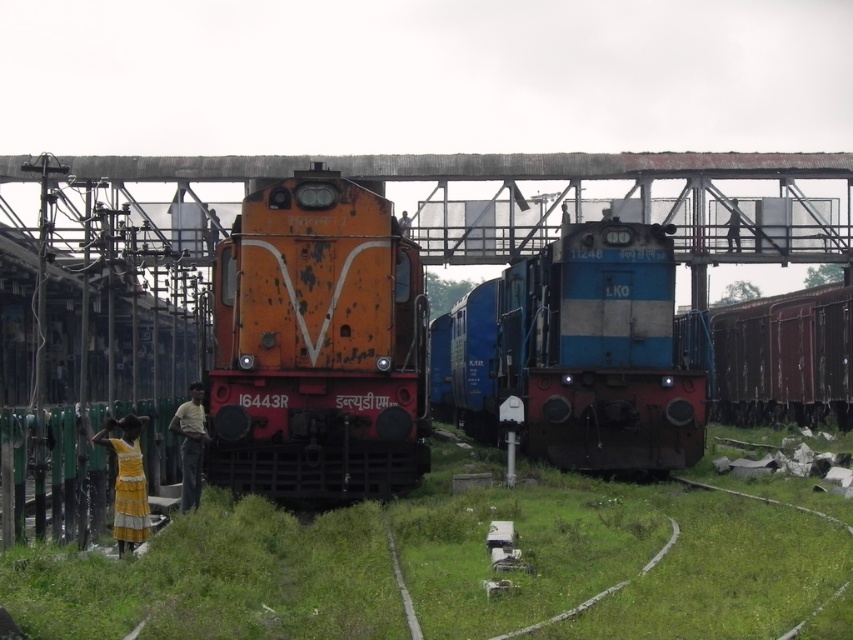
Between point (753, 244) and point (138, 493), which one is positioned in front?

Positioned in front is point (138, 493).

Can you confirm if metallic bridge at upper center is wider than yellow cotton dress at lower left?

Indeed, metallic bridge at upper center has a greater width compared to yellow cotton dress at lower left.

Find the location of a particular element. The width and height of the screenshot is (853, 640). metallic bridge at upper center is located at coordinates (544, 200).

Identify the location of metallic bridge at upper center. This screenshot has height=640, width=853. (544, 200).

Can you confirm if rusty metal train at center is bigger than metallic bridge at upper center?

Actually, rusty metal train at center might be smaller than metallic bridge at upper center.

Is rusty metal train at center smaller than metallic bridge at upper center?

Yes, rusty metal train at center is smaller than metallic bridge at upper center.

Between point (361, 435) and point (453, 252), which one is positioned behind?

Positioned behind is point (453, 252).

The height and width of the screenshot is (640, 853). What are the coordinates of `rusty metal train at center` in the screenshot? It's located at (317, 346).

Which is below, rusty metal train at center or light brown fabric shirt at lower left?

light brown fabric shirt at lower left

What do you see at coordinates (317, 346) in the screenshot? The image size is (853, 640). I see `rusty metal train at center` at bounding box center [317, 346].

The height and width of the screenshot is (640, 853). In order to click on rusty metal train at center in this screenshot , I will do `click(317, 346)`.